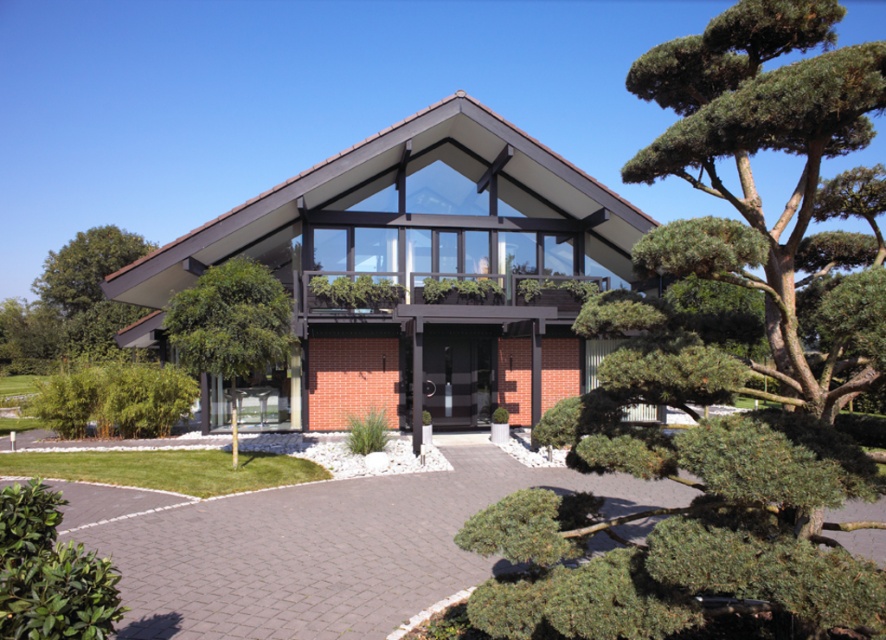
Question: Observing the image, what is the correct spatial positioning of green textured tree at right in reference to green leafy tree at center?

Choices:
 (A) above
 (B) below

Answer: (B)

Question: Which of these objects is positioned farthest from the green textured tree at right?

Choices:
 (A) green leafy tree at center
 (B) green textured tree at upper right

Answer: (A)

Question: Estimate the real-world distances between objects in this image. Which object is closer to the brick paved driveway at center?

Choices:
 (A) green textured tree at right
 (B) green leafy tree at center

Answer: (B)

Question: Among these objects, which one is farthest from the camera?

Choices:
 (A) green leafy tree at center
 (B) green textured tree at upper right
 (C) green textured tree at right

Answer: (A)

Question: Observing the image, what is the correct spatial positioning of green textured tree at right in reference to green textured tree at upper right?

Choices:
 (A) above
 (B) below

Answer: (B)

Question: In this image, where is green textured tree at right located relative to green textured tree at upper right?

Choices:
 (A) above
 (B) below

Answer: (B)